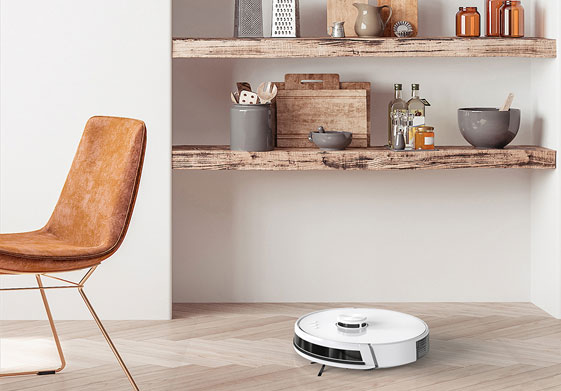
Where is `jar`? The height and width of the screenshot is (391, 561). jar is located at coordinates (255, 131).